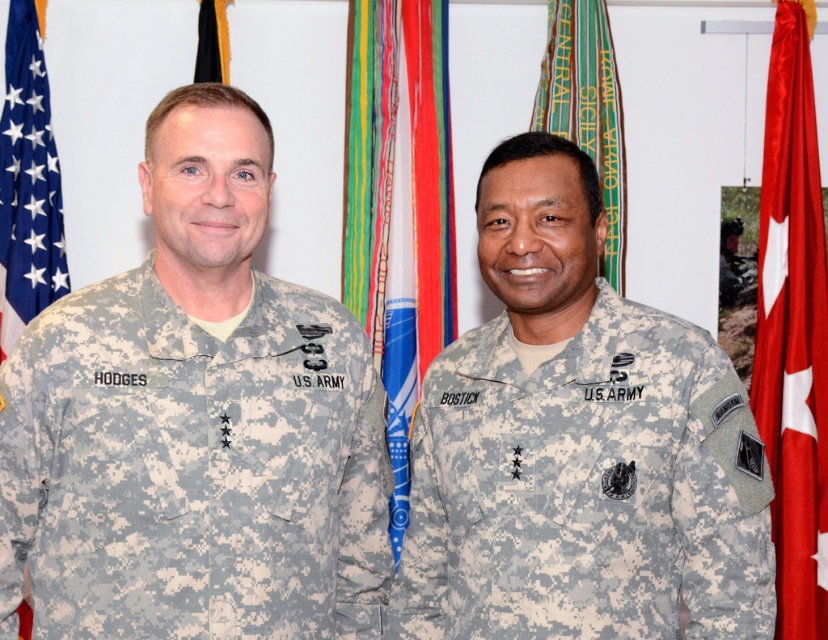
Question: Is red satin flag at right positioned behind black fabric flag at upper center?

Choices:
 (A) no
 (B) yes

Answer: (A)

Question: Which object is farther from the camera taking this photo?

Choices:
 (A) blue fabric flag at left
 (B) black fabric flag at upper center
 (C) green fabric flag at upper center
 (D) blue fabric flag at center

Answer: (B)

Question: Which point is farther to the camera?

Choices:
 (A) camouflage fabric uniform at left
 (B) black fabric flag at upper center

Answer: (B)

Question: Can you confirm if red satin flag at right is positioned to the left of blue fabric flag at left?

Choices:
 (A) no
 (B) yes

Answer: (A)

Question: Estimate the real-world distances between objects in this image. Which object is closer to the blue fabric flag at center?

Choices:
 (A) green fabric flag at upper center
 (B) camouflage fabric uniform at right
 (C) black fabric flag at upper center

Answer: (A)

Question: Is camouflage fabric uniform at right wider than red satin flag at right?

Choices:
 (A) no
 (B) yes

Answer: (B)